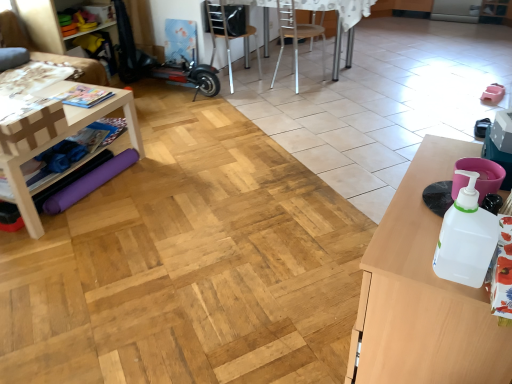
Question: From the image's perspective, is brown fabric couch at left located above or below metallic silver table at center?

Choices:
 (A) above
 (B) below

Answer: (B)

Question: Is point (9, 9) positioned closer to the camera than point (266, 24)?

Choices:
 (A) farther
 (B) closer

Answer: (B)

Question: Considering the real-world distances, which object is farthest from the white wood table at left, the first table positioned from the left?

Choices:
 (A) brown fabric couch at left
 (B) metallic silver table at center
 (C) metallic silver chair at center, the 2th chair in the left-to-right sequence
 (D) black plastic chair at center, the first chair in the left-to-right sequence
 (E) wooden table at right, which appears as the 1th table when viewed from the right

Answer: (B)

Question: Which object is positioned farthest from the wooden table at right, marked as the 2th table in a back-to-front arrangement?

Choices:
 (A) brown fabric couch at left
 (B) black plastic chair at center, the first chair in the left-to-right sequence
 (C) white wood table at left, the first table positioned from the left
 (D) metallic silver chair at center, which ranks as the first chair in right-to-left order
 (E) white plastic bottle at right

Answer: (A)